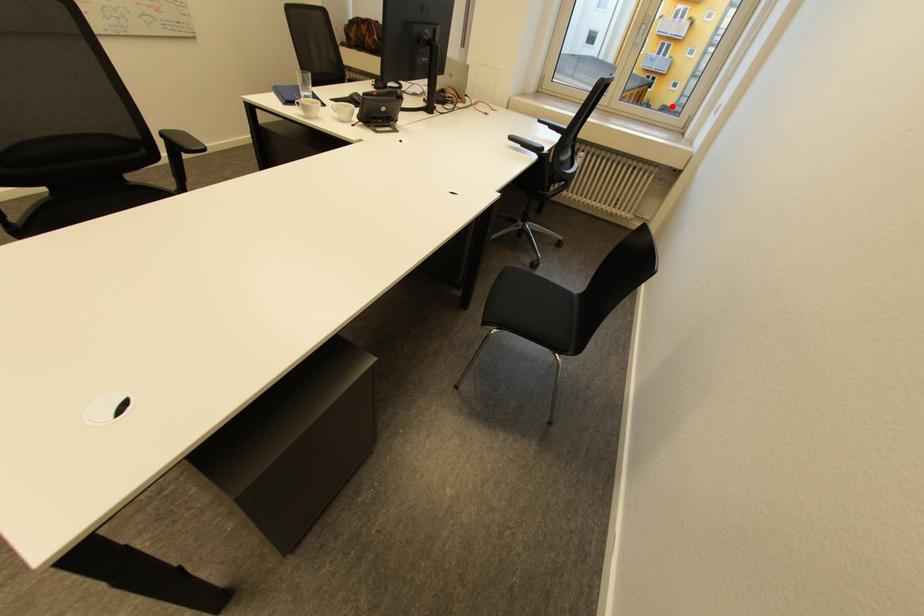
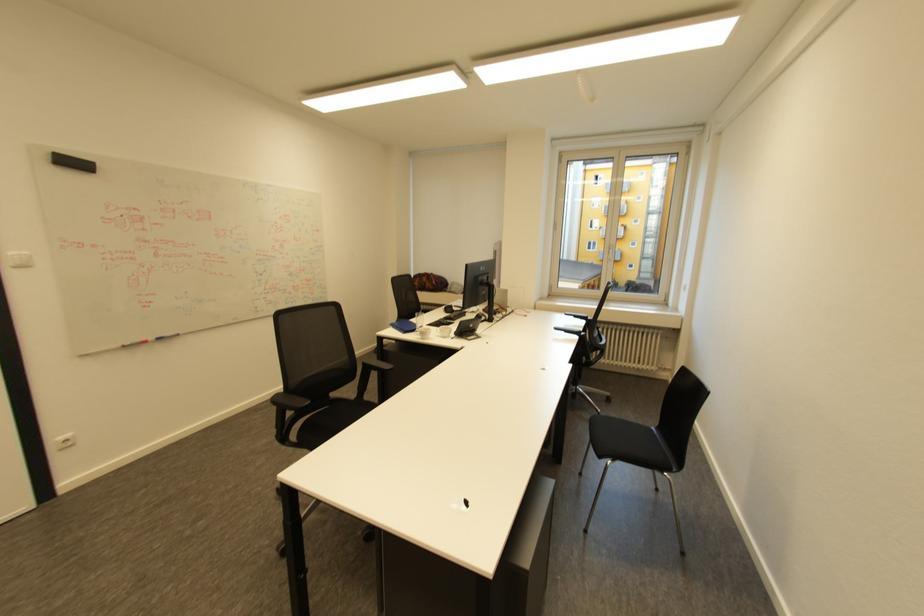
The point at the highlighted location is marked in the first image. Where is the corresponding point in the second image?

(636, 281)